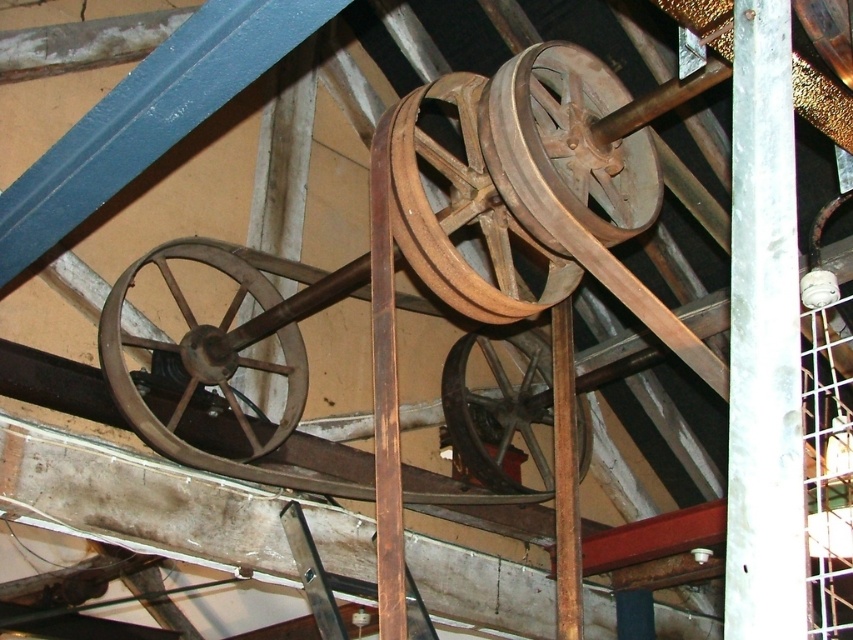
The width and height of the screenshot is (853, 640). Describe the element at coordinates (566, 147) in the screenshot. I see `rustic wood wheel at center` at that location.

Can you confirm if rustic wood wheel at center is smaller than wooden wheel at center?

Yes, rustic wood wheel at center is smaller than wooden wheel at center.

Who is more distant from viewer, (547, 138) or (456, 408)?

The point (456, 408) is behind.

Identify the location of rustic wood wheel at center. (566, 147).

This screenshot has height=640, width=853. Describe the element at coordinates (460, 212) in the screenshot. I see `wooden pulley at center` at that location.

Measure the distance between wooden pulley at center and wooden wheel at left.

The distance of wooden pulley at center from wooden wheel at left is 1.04 meters.

The height and width of the screenshot is (640, 853). In order to click on wooden pulley at center in this screenshot , I will do `click(460, 212)`.

Does wooden pulley at center appear under wooden wheel at center?

No, wooden pulley at center is not below wooden wheel at center.

Is wooden pulley at center thinner than wooden wheel at center?

Correct, wooden pulley at center's width is less than wooden wheel at center's.

Does point (500, 272) lie in front of point (457, 349)?

Yes.

Identify the location of wooden pulley at center. coord(460,212).